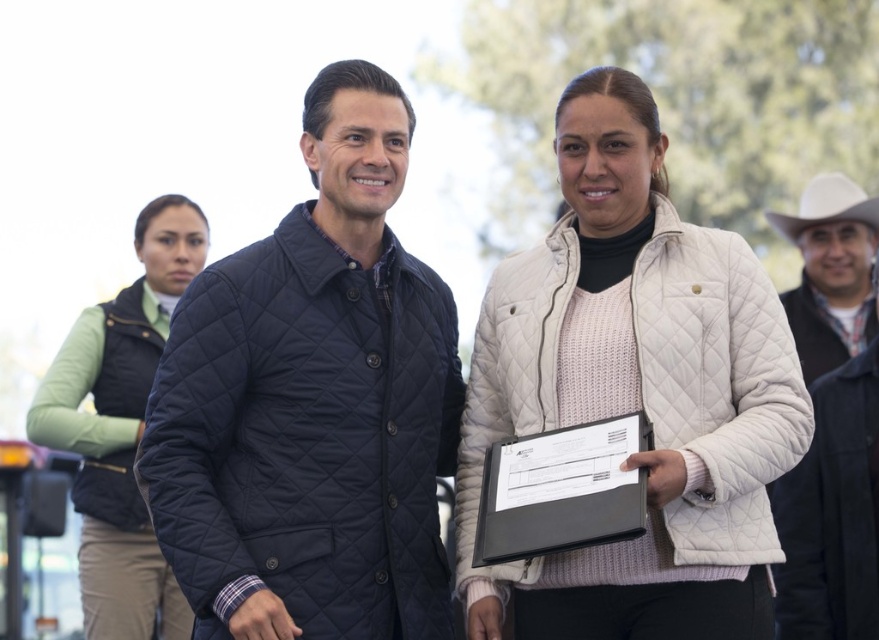
Is navy quilted jacket at center to the left of white quilted jacket at right from the viewer's perspective?

Correct, you'll find navy quilted jacket at center to the left of white quilted jacket at right.

Is navy quilted jacket at center above white quilted jacket at right?

Actually, navy quilted jacket at center is below white quilted jacket at right.

Is point (440, 353) in front of point (874, 572)?

Yes, it is in front of point (874, 572).

This screenshot has height=640, width=879. Find the location of `navy quilted jacket at center`. navy quilted jacket at center is located at coordinates (311, 403).

Which is below, navy quilted jacket at center or white felt cowboy hat at right?

navy quilted jacket at center is below.

This screenshot has width=879, height=640. What do you see at coordinates (311, 403) in the screenshot?
I see `navy quilted jacket at center` at bounding box center [311, 403].

At what (x,y) coordinates should I click in order to perform the action: click on navy quilted jacket at center. Please return your answer as a coordinate pair (x, y). Looking at the image, I should click on (311, 403).

Does white quilted jacket at center have a greater height compared to light green fabric vest at upper left?

No, white quilted jacket at center is not taller than light green fabric vest at upper left.

Does white quilted jacket at center have a larger size compared to light green fabric vest at upper left?

Incorrect, white quilted jacket at center is not larger than light green fabric vest at upper left.

Looking at this image, who is more distant from viewer, (x=604, y=406) or (x=86, y=438)?

The point (x=86, y=438) is behind.

What are the coordinates of `white quilted jacket at center` in the screenshot? It's located at (636, 392).